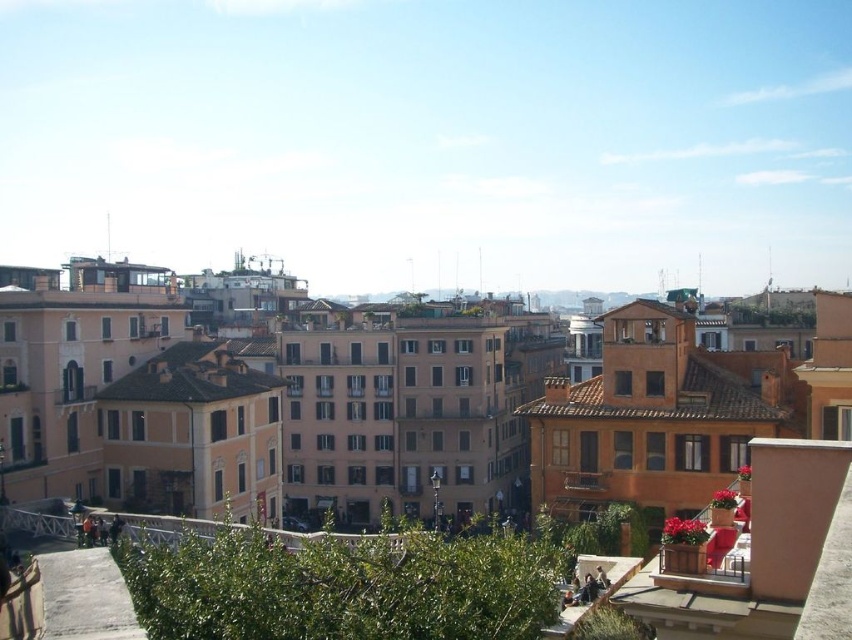
Between wooden planter at lower right and white metal railing at center, which one appears on the left side from the viewer's perspective?

white metal railing at center

Does wooden planter at lower right lie behind white metal railing at center?

No.

Is point (730, 490) positioned after point (186, 524)?

No, it is not.

At what (x,y) coordinates should I click in order to perform the action: click on wooden planter at lower right. Please return your answer as a coordinate pair (x, y). Image resolution: width=852 pixels, height=640 pixels. Looking at the image, I should click on (709, 545).

Which is behind, point (134, 538) or point (597, 481)?

Positioned behind is point (597, 481).

Can you confirm if white metal railing at center is taller than wooden at center?

Correct, white metal railing at center is much taller as wooden at center.

Find the location of a particular element. white metal railing at center is located at coordinates (167, 528).

The width and height of the screenshot is (852, 640). I want to click on white metal railing at center, so click(x=167, y=528).

Can you confirm if wooden planter at lower right is taller than wooden at center?

Yes, wooden planter at lower right is taller than wooden at center.

What do you see at coordinates (709, 545) in the screenshot? Image resolution: width=852 pixels, height=640 pixels. I see `wooden planter at lower right` at bounding box center [709, 545].

Which is behind, point (741, 534) or point (571, 484)?

Point (571, 484)

Find the location of a particular element. Image resolution: width=852 pixels, height=640 pixels. wooden planter at lower right is located at coordinates (709, 545).